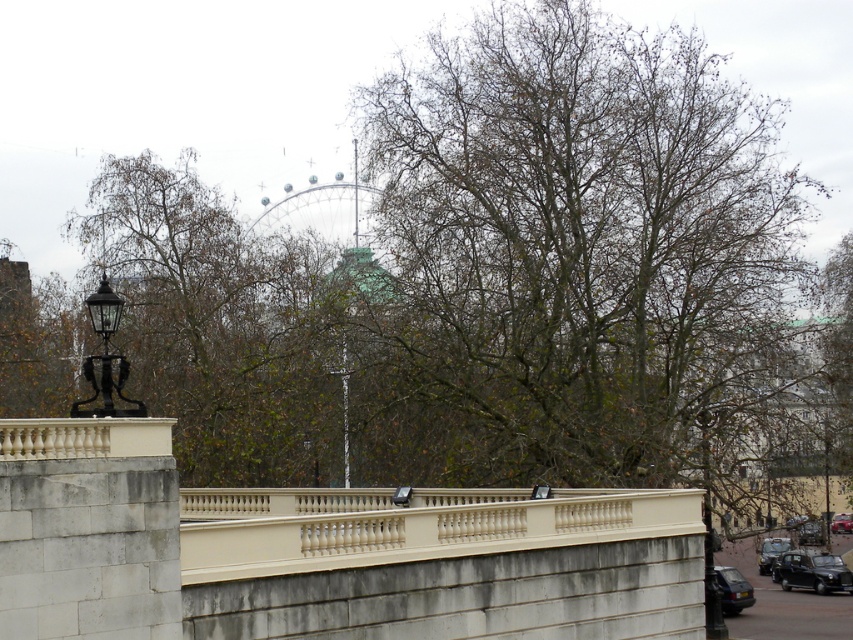
Describe the element at coordinates (322, 552) in the screenshot. This screenshot has height=640, width=853. I see `white stone bridge at center` at that location.

Can you confirm if white stone bridge at center is thinner than red metallic car at center?

No.

Which is behind, point (529, 512) or point (851, 518)?

The point (851, 518) is more distant.

This screenshot has height=640, width=853. What are the coordinates of `white stone bridge at center` in the screenshot? It's located at (322, 552).

Is white stone bridge at center positioned in front of black glossy car at lower right?

Yes, white stone bridge at center is closer to the viewer.

The image size is (853, 640). What do you see at coordinates (322, 552) in the screenshot?
I see `white stone bridge at center` at bounding box center [322, 552].

What are the coordinates of `white stone bridge at center` in the screenshot? It's located at (322, 552).

Does bare branches at center appear on the right side of black glossy car at lower right?

Incorrect, bare branches at center is not on the right side of black glossy car at lower right.

Looking at this image, who is positioned more to the right, bare branches at center or black glossy car at lower right?

Positioned to the right is black glossy car at lower right.

Locate an element on the screen. This screenshot has width=853, height=640. bare branches at center is located at coordinates (584, 237).